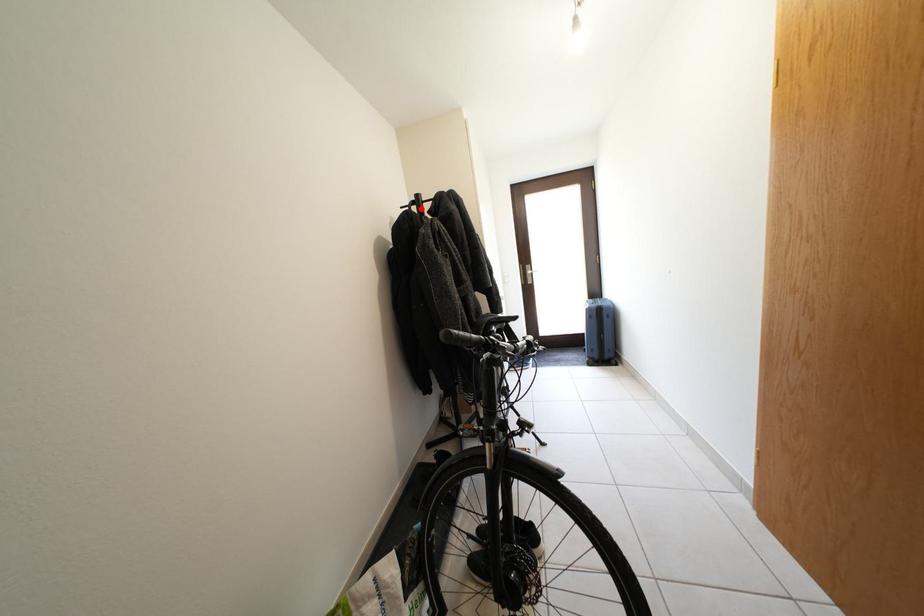
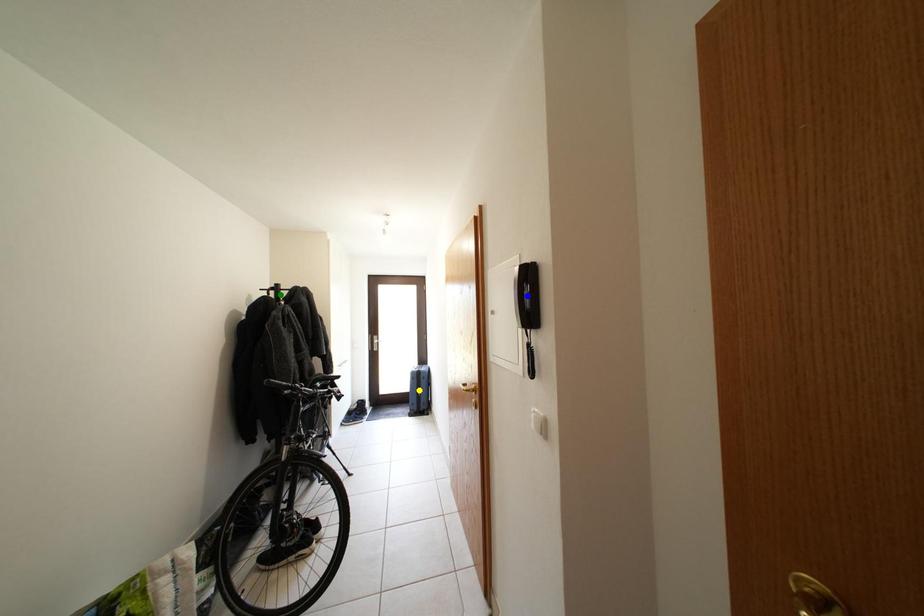
Question: I am providing you with two images of the same scene from different viewpoints. A red point is marked on the first image. You are given multiple points on the second image. Which mark in image 2 goes with the point in image 1?

Choices:
 (A) yellow point
 (B) green point
 (C) blue point

Answer: (B)